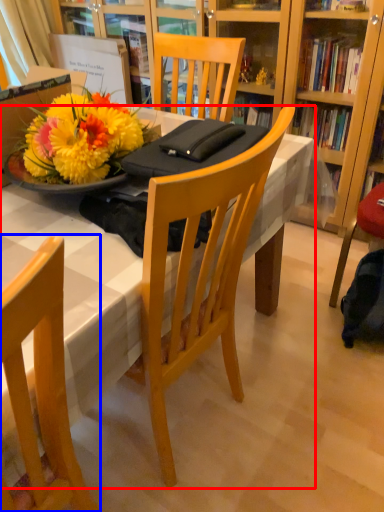
Question: Which point is further to the camera, desk (highlighted by a red box) or chair (highlighted by a blue box)?

Choices:
 (A) desk
 (B) chair

Answer: (A)